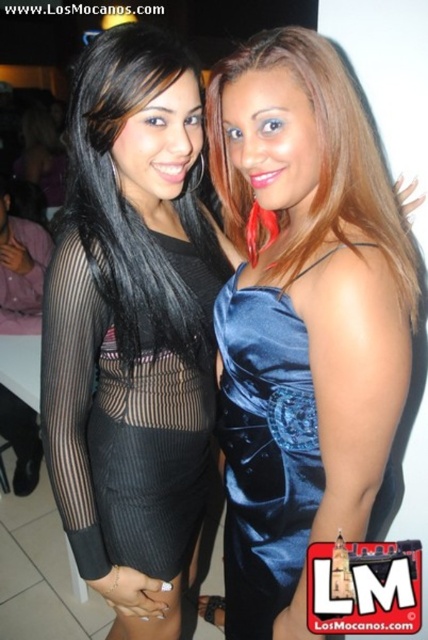
Describe the element at coordinates (133, 328) in the screenshot. This screenshot has width=428, height=640. I see `black sheer dress at center` at that location.

Who is shorter, black sheer dress at center or black mesh dress at center?

black mesh dress at center

In order to click on black sheer dress at center in this screenshot , I will do `click(133, 328)`.

Between satin blue dress at upper right and satin blue dress at center, which one appears on the right side from the viewer's perspective?

satin blue dress at center is more to the right.

Describe the element at coordinates (264, 452) in the screenshot. I see `satin blue dress at upper right` at that location.

Locate an element on the screen. The image size is (428, 640). satin blue dress at upper right is located at coordinates (264, 452).

Consider the image. How far apart are black sheer dress at center and satin blue dress at center?

black sheer dress at center is 11.70 inches from satin blue dress at center.

Is point (145, 172) positioned behind point (330, 208)?

Yes, point (145, 172) is farther from viewer.

Locate an element on the screen. This screenshot has width=428, height=640. black sheer dress at center is located at coordinates (133, 328).